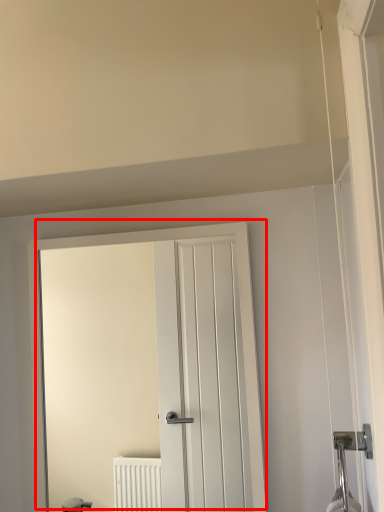
Question: Considering the relative positions of door (annotated by the red box) and door handle in the image provided, where is door (annotated by the red box) located with respect to the staircase?

Choices:
 (A) left
 (B) right

Answer: (A)